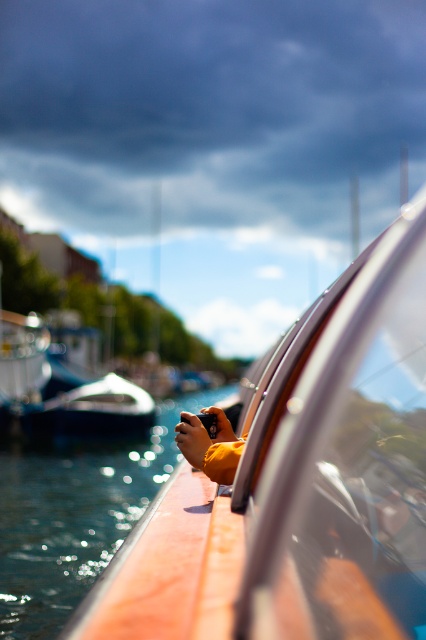
How far apart are transparent glass car window at center and white glossy boat at center?

A distance of 27.99 meters exists between transparent glass car window at center and white glossy boat at center.

Is point (333, 568) closer to camera compared to point (78, 396)?

Yes, it is in front of point (78, 396).

Is point (247, 525) closer to camera compared to point (108, 426)?

Yes, point (247, 525) is closer to viewer.

Image resolution: width=426 pixels, height=640 pixels. What are the coordinates of `transparent glass car window at center` in the screenshot? It's located at (348, 468).

Does transparent glass car window at center have a lesser width compared to clear water at boat right?

Yes, transparent glass car window at center is thinner than clear water at boat right.

Between point (313, 464) and point (37, 468), which one is positioned in front?

Positioned in front is point (313, 464).

At what (x,y) coordinates should I click in order to perform the action: click on transparent glass car window at center. Please return your answer as a coordinate pair (x, y). This screenshot has height=640, width=426. Looking at the image, I should click on (348, 468).

What are the coordinates of `transparent glass car window at center` in the screenshot? It's located at (348, 468).

Is clear water at boat right positioned behind white glossy boat at center?

No, clear water at boat right is in front of white glossy boat at center.

Which of these two, clear water at boat right or white glossy boat at center, stands taller?

Standing taller between the two is clear water at boat right.

Which is in front, point (19, 452) or point (100, 397)?

Positioned in front is point (19, 452).

The width and height of the screenshot is (426, 640). Find the location of `clear water at boat right`. clear water at boat right is located at coordinates (75, 516).